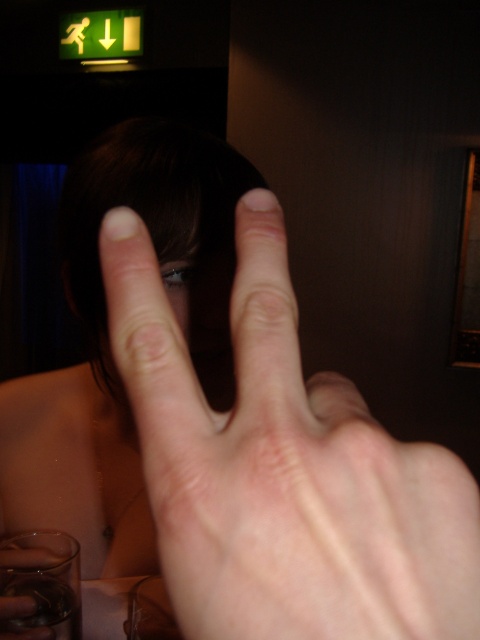
You are holding a small flashlight that is 2 inches in diameter. You want to shine it directly at the point marked as point (345, 566). Given that the flashlight is currently at your eye level, can you estimate whether the flashlight will reach the point without needing to move your head?

The point (345, 566) is 6.21 inches away from the viewer. Since the flashlight is 2 inches in diameter, it can easily cover the distance and reach the point without needing to move your head.

From the picture: You are a bartender preparing a drink. You have to place a garnish on the clear glass at lower left. Can you do it without moving the pale skin hand at center?

The pale skin hand at center is positioned over the clear glass at lower left, so you cannot place the garnish without moving the hand.